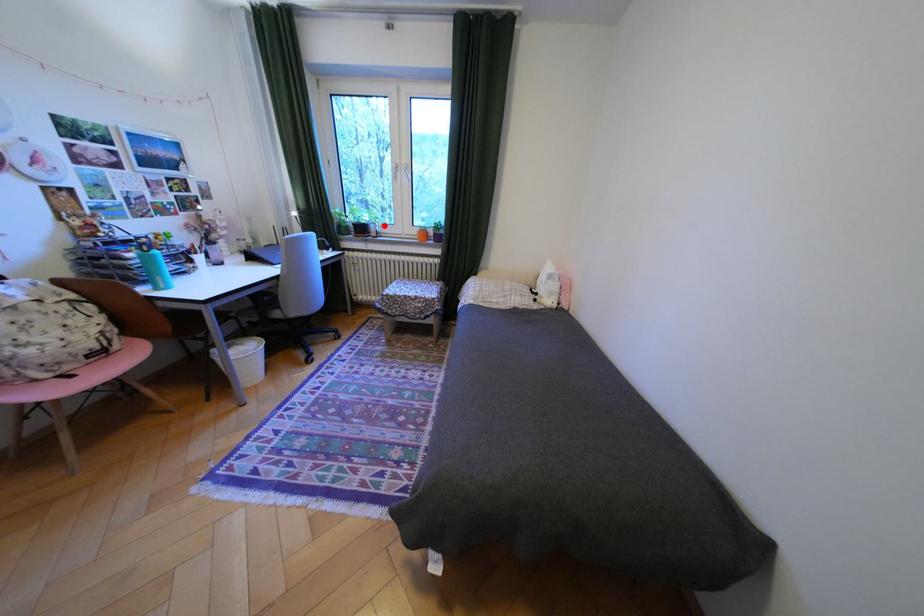
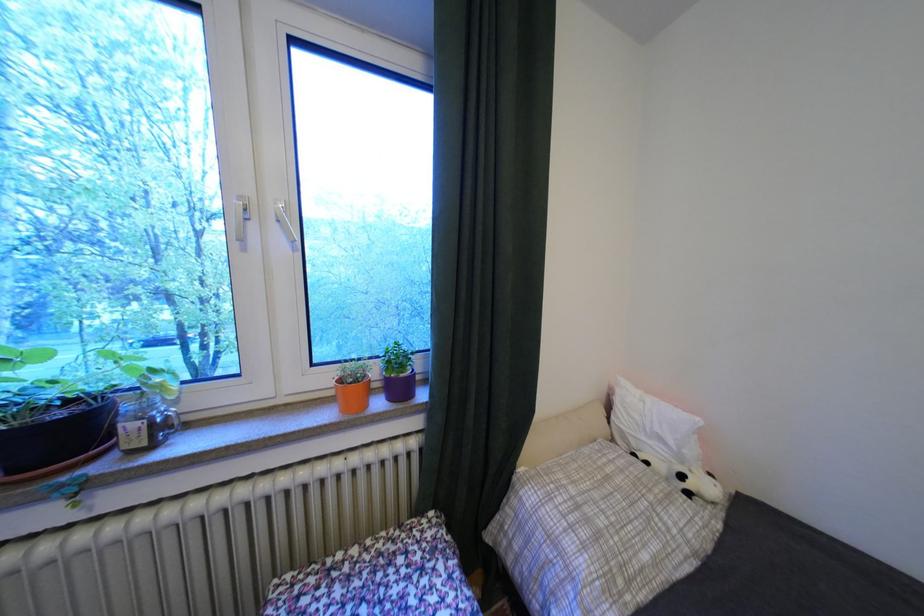
Find the pixel in the second image that matches the highlighted location in the first image.

(138, 408)